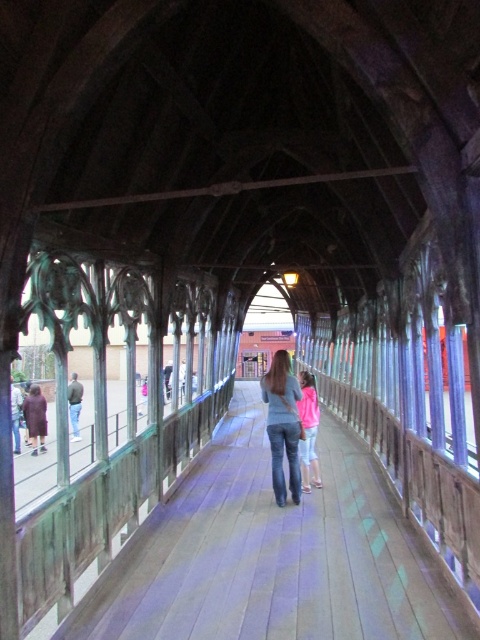
Question: Is denim jeans at center above pink fleece jacket at center?

Choices:
 (A) no
 (B) yes

Answer: (B)

Question: Which is nearer to the denim jeans at center?

Choices:
 (A) pink fleece jacket at center
 (B) wooden walkway at center

Answer: (A)

Question: Which of the following is the closest to the observer?

Choices:
 (A) (370, 540)
 (B) (276, 417)
 (C) (305, 374)

Answer: (A)

Question: Where is wooden walkway at center located in relation to denim jeans at center in the image?

Choices:
 (A) left
 (B) right

Answer: (A)

Question: Which point appears closest to the camera in this image?

Choices:
 (A) (305, 460)
 (B) (285, 429)
 (C) (297, 564)

Answer: (C)

Question: Can you confirm if denim jeans at center is smaller than pink fleece jacket at center?

Choices:
 (A) yes
 (B) no

Answer: (A)